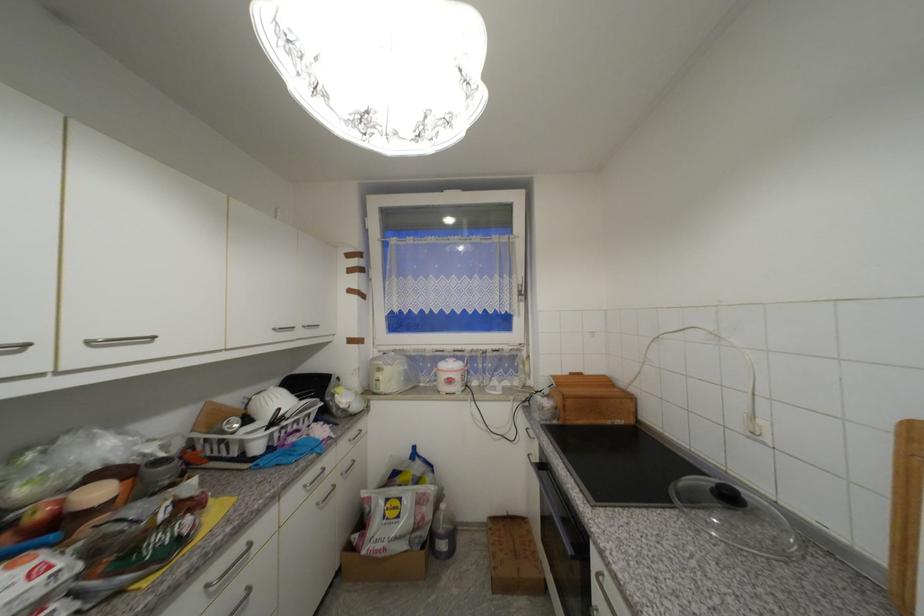
Where is `red apple`? The height and width of the screenshot is (616, 924). red apple is located at coordinates (41, 517).